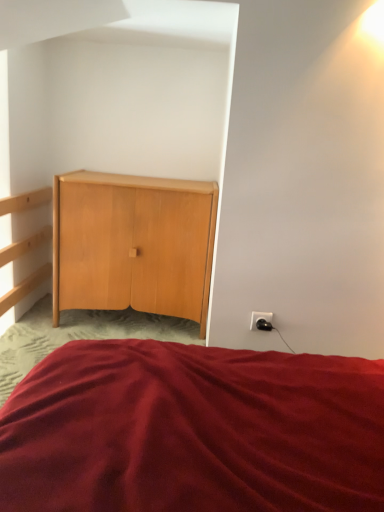
You are a GUI agent. You are given a task and a screenshot of the screen. Output one action in this format:
    pyautogui.click(x=<x>, y=<y>)
    Task: Click on the black plastic outlet at lower right
    This screenshot has height=512, width=384.
    Given the screenshot: What is the action you would take?
    261,321

Describe the element at coordinates (193, 431) in the screenshot. I see `burgundy fabric bed at center` at that location.

Find the location of a particular element. burgundy fabric bed at center is located at coordinates (193, 431).

I want to click on light wood cabinet at center, so click(x=134, y=244).

Where is `black plastic outlet at lower right`? The height and width of the screenshot is (512, 384). black plastic outlet at lower right is located at coordinates (261, 321).

From a real-world perspective, is light wood cabinet at center above or below black plastic outlet at lower right?

From a real-world perspective, light wood cabinet at center is physically above black plastic outlet at lower right.

This screenshot has height=512, width=384. Find the location of `nightstand lying behind the black plastic outlet at lower right`. nightstand lying behind the black plastic outlet at lower right is located at coordinates (134, 244).

From the image's perspective, between light wood cabinet at center and black plastic outlet at lower right, which one is located above?

From the image's view, light wood cabinet at center is above.

Is light wood cabinet at center looking in the opposite direction of black plastic outlet at lower right?

No, light wood cabinet at center's orientation is not away from black plastic outlet at lower right.

Does point (96, 470) come closer to viewer compared to point (143, 257)?

Yes, point (96, 470) is in front of point (143, 257).

At what (x,y) coordinates should I click in order to perform the action: click on nightstand that appears above the burgundy fabric bed at center (from the image's perspective). Please return your answer as a coordinate pair (x, y). Looking at the image, I should click on (134, 244).

Can you confirm if burgundy fabric bed at center is taller than light wood cabinet at center?

No, burgundy fabric bed at center is not taller than light wood cabinet at center.

Is burgundy fabric bed at center oriented towards light wood cabinet at center?

No, burgundy fabric bed at center is not oriented towards light wood cabinet at center.

Which object is positioned more to the right, black plastic outlet at lower right or burgundy fabric bed at center?

Positioned to the right is black plastic outlet at lower right.

In the scene shown: How different are the orientations of black plastic outlet at lower right and burgundy fabric bed at center in degrees?

They differ by 89.8 degrees in their facing directions.

From the image's perspective, relative to burgundy fabric bed at center, is black plastic outlet at lower right above or below?

black plastic outlet at lower right is situated higher than burgundy fabric bed at center in the image.

Considering the points (255, 324) and (310, 391), which point is in front, point (255, 324) or point (310, 391)?

The point (310, 391) is closer.

Considering the positions of objects black plastic outlet at lower right and light wood cabinet at center in the image provided, who is more to the left, black plastic outlet at lower right or light wood cabinet at center?

From the viewer's perspective, light wood cabinet at center appears more on the left side.

Which is less distant, (256, 320) or (195, 314)?

The point (256, 320) is in front.

Is light wood cabinet at center taller or shorter than burgundy fabric bed at center?

Considering their sizes, light wood cabinet at center has more height than burgundy fabric bed at center.

Between light wood cabinet at center and burgundy fabric bed at center, which one appears on the left side from the viewer's perspective?

light wood cabinet at center is more to the left.

Locate an element on the screen. The height and width of the screenshot is (512, 384). bed on the right of light wood cabinet at center is located at coordinates (193, 431).

Locate an element on the screen. This screenshot has height=512, width=384. electric outlet above the burgundy fabric bed at center (from a real-world perspective) is located at coordinates (261, 321).

Which is farther, (296, 502) or (272, 314)?

Positioned behind is point (272, 314).

Considering the positions of objects burgundy fabric bed at center and black plastic outlet at lower right in the image provided, who is more to the right, burgundy fabric bed at center or black plastic outlet at lower right?

From the viewer's perspective, black plastic outlet at lower right appears more on the right side.

Is burgundy fabric bed at center surrounding black plastic outlet at lower right?

That's incorrect, black plastic outlet at lower right is not inside burgundy fabric bed at center.

Find the location of a particular element. electric outlet below the light wood cabinet at center (from the image's perspective) is located at coordinates (261, 321).

Locate an element on the screen. This screenshot has width=384, height=512. nightstand behind the burgundy fabric bed at center is located at coordinates (134, 244).

Estimate the real-world distances between objects in this image. Which object is further from burgundy fabric bed at center, light wood cabinet at center or black plastic outlet at lower right?

The object further to burgundy fabric bed at center is light wood cabinet at center.

Considering their positions, is burgundy fabric bed at center positioned closer to black plastic outlet at lower right than light wood cabinet at center?

burgundy fabric bed at center.

Considering their positions, is burgundy fabric bed at center positioned further to light wood cabinet at center than black plastic outlet at lower right?

Based on the image, burgundy fabric bed at center appears to be further to light wood cabinet at center.

Looking at the image, which one is located further to burgundy fabric bed at center, black plastic outlet at lower right or light wood cabinet at center?

The object further to burgundy fabric bed at center is light wood cabinet at center.

Looking at the image, which one is located closer to light wood cabinet at center, black plastic outlet at lower right or burgundy fabric bed at center?

black plastic outlet at lower right is positioned closer to the anchor light wood cabinet at center.

Based on their spatial positions, is light wood cabinet at center or burgundy fabric bed at center further from black plastic outlet at lower right?

light wood cabinet at center lies further to black plastic outlet at lower right than the other object.

Image resolution: width=384 pixels, height=512 pixels. I want to click on electric outlet between burgundy fabric bed at center and light wood cabinet at center along the z-axis, so click(261, 321).